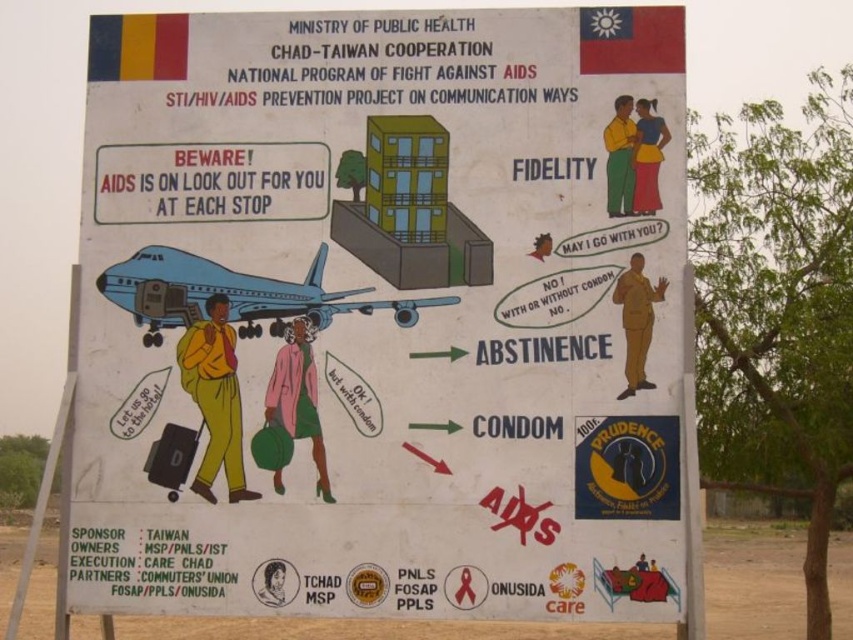
Identify the location of white paper poster at center. The image size is (853, 640). (383, 317).

Is white paper poster at center above light blue glossy airplane at left?

Actually, white paper poster at center is below light blue glossy airplane at left.

Is point (605, 580) positioned before point (410, 316)?

Yes.

Find the location of `white paper poster at center`. white paper poster at center is located at coordinates (383, 317).